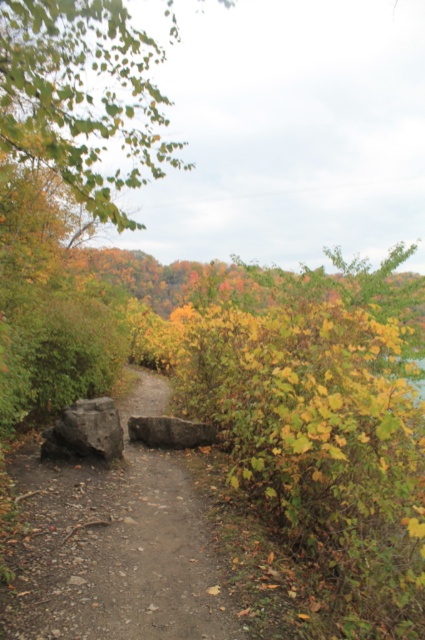
You are standing at the point marked as point (84, 97) in the image. Looking around, you see a green leafy tree at upper left and a large weathered rock on the left side of the path. Which object is closer to your current position?

The point (84, 97) is on the green leafy tree at upper left, so the green leafy tree at upper left is closer to your current position than the large weathered rock on the left side of the path.

You are standing at the point with coordinates point (x=85, y=432). What object are you standing on?

You are standing on the dark gray rock at center.

You are an artist planning to paint the scene. You want to ensure the dark gray rock at center is not too small compared to the green leafy tree at upper left. Based on the scene, can you determine if the rock will appear smaller in width than the tree?

The green leafy tree at upper left might be wider than dark gray rock at center, so there is a possibility that the rock will appear smaller in width compared to the tree.